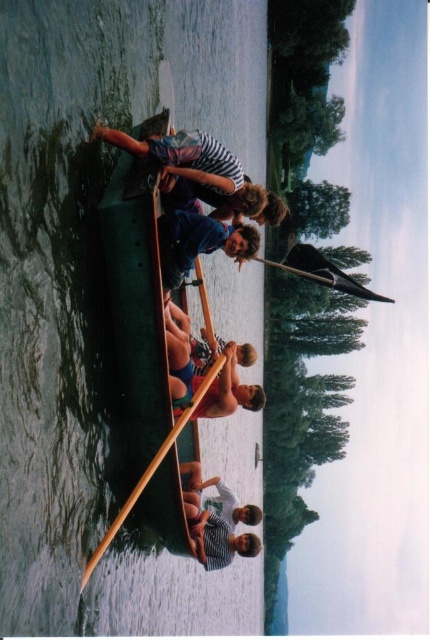
Which of these two, green wood boat at center or striped fabric person at upper center, stands taller?

Standing taller between the two is green wood boat at center.

Between green wood boat at center and striped fabric person at upper center, which one is positioned higher?

striped fabric person at upper center

Who is more forward, (71, 284) or (218, 150)?

Point (71, 284) is more forward.

Identify the location of green wood boat at center. (85, 253).

Can you confirm if green wood boat at center is thinner than striped fabric person at center?

No, green wood boat at center is not thinner than striped fabric person at center.

Is green wood boat at center positioned in front of striped fabric person at center?

Yes, green wood boat at center is closer to the viewer.

Is point (242, 26) positioned after point (208, 552)?

Yes, point (242, 26) is farther from viewer.

At what (x,y) coordinates should I click in order to perform the action: click on green wood boat at center. Please return your answer as a coordinate pair (x, y). The width and height of the screenshot is (430, 640). Looking at the image, I should click on (85, 253).

This screenshot has width=430, height=640. What are the coordinates of `blue denim shorts at center` in the screenshot? It's located at (205, 371).

Is blue denim shorts at center taller than blue cotton shirt at center?

Yes.

This screenshot has height=640, width=430. In order to click on blue denim shorts at center in this screenshot , I will do `click(205, 371)`.

Find the location of `blue denim shorts at center`. blue denim shorts at center is located at coordinates (205, 371).